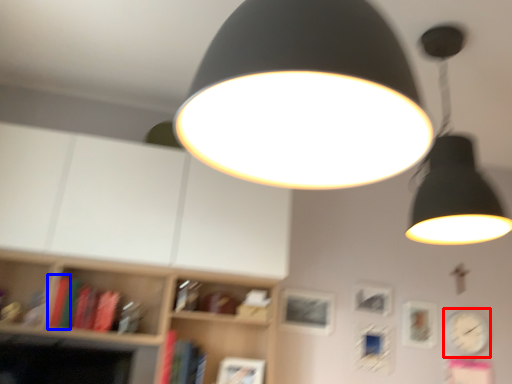
Question: Which object is closer to the camera taking this photo, clock (highlighted by a red box) or book (highlighted by a blue box)?

Choices:
 (A) clock
 (B) book

Answer: (B)